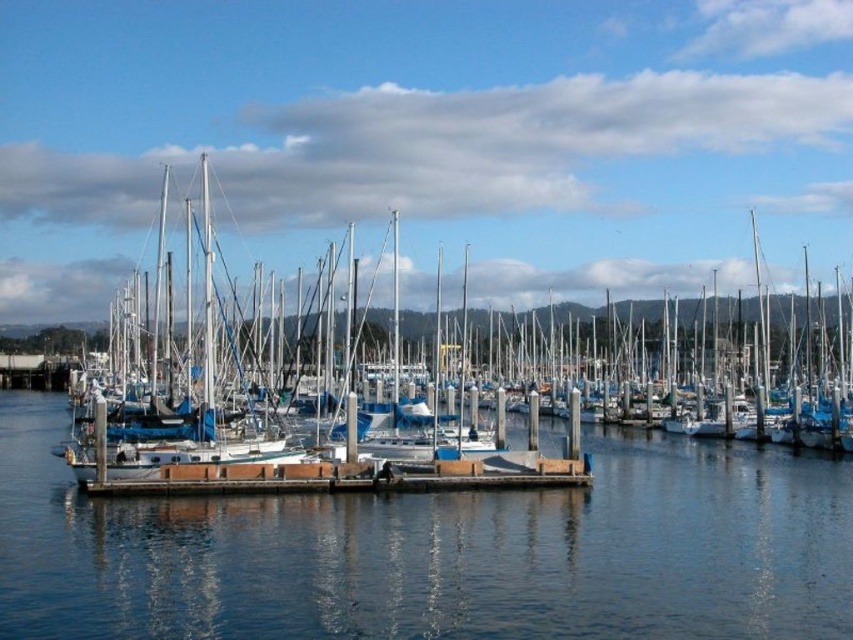
You are standing at the edge of the marina and want to determine the relative positions of two points marked in the scene. Which point, point (55, 541) or point (544, 483), is closer to you?

Point (55, 541) is closer to the viewer than point (544, 483).

You are standing on the wooden pier and looking at the clear water at center and the white matte sailboat at center. Which object is positioned lower in the scene?

The clear water at center is located below the white matte sailboat at center, so it is positioned lower in the scene.